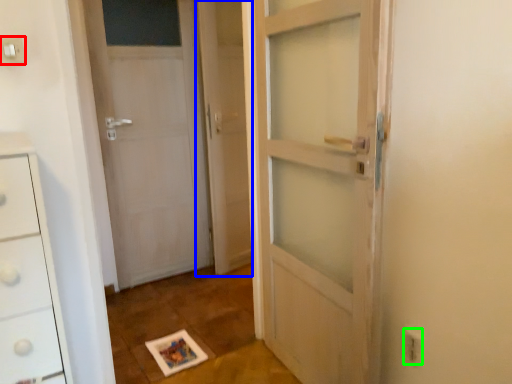
Question: Which object is positioned closest to electric outlet (highlighted by a red box)? Select from screen door (highlighted by a blue box) and electric outlet (highlighted by a green box).

Choices:
 (A) screen door
 (B) electric outlet

Answer: (B)